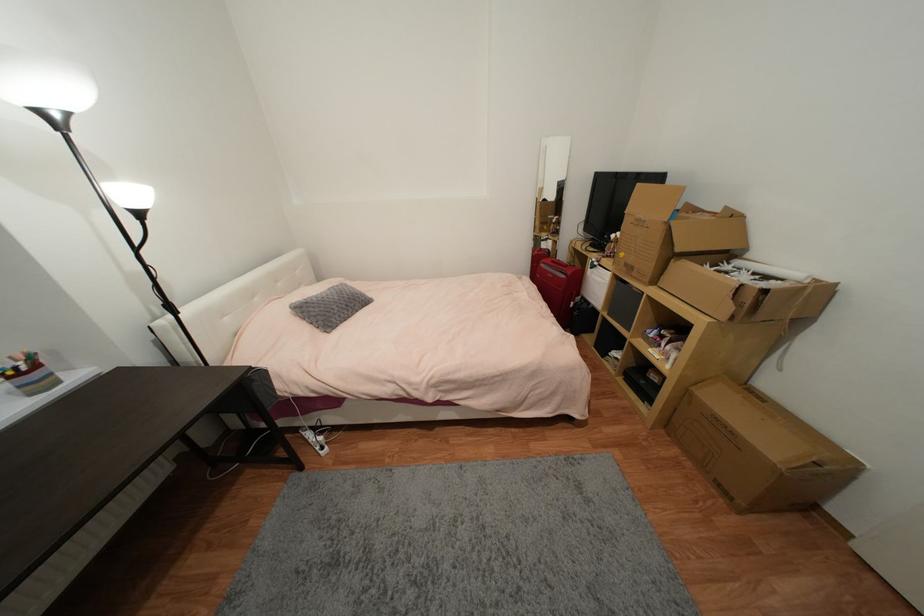
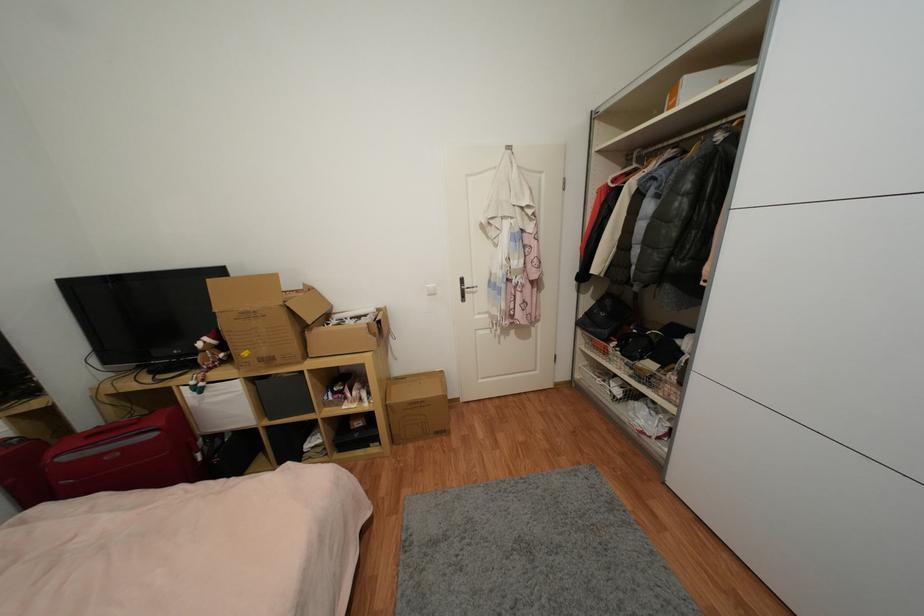
Find the pixel in the second image that matches [634,270] in the first image.

(274, 361)